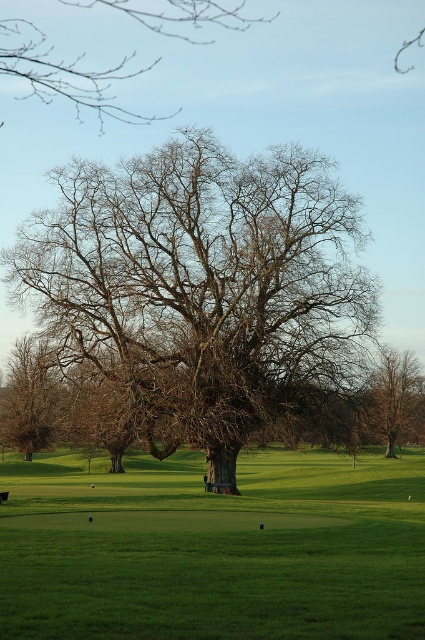
Can you confirm if bare wood oak tree at center is positioned to the right of green grass at center?

Incorrect, bare wood oak tree at center is not on the right side of green grass at center.

Is bare wood oak tree at center taller than green grass at center?

Yes.

This screenshot has height=640, width=425. Identify the location of bare wood oak tree at center. (203, 284).

Is green grass at center below bare branches at upper left?

Yes.

Between green grass at center and bare branches at upper left, which one has less height?

Standing shorter between the two is green grass at center.

Locate an element on the screen. The height and width of the screenshot is (640, 425). green grass at center is located at coordinates pyautogui.click(x=214, y=548).

Does bare branches at upper left lie in front of brown leafless tree at right?

No, it is behind brown leafless tree at right.

Is bare branches at upper left above brown leafless tree at right?

Indeed, bare branches at upper left is positioned over brown leafless tree at right.

Image resolution: width=425 pixels, height=640 pixels. In order to click on bare branches at upper left in this screenshot , I will do `click(65, 74)`.